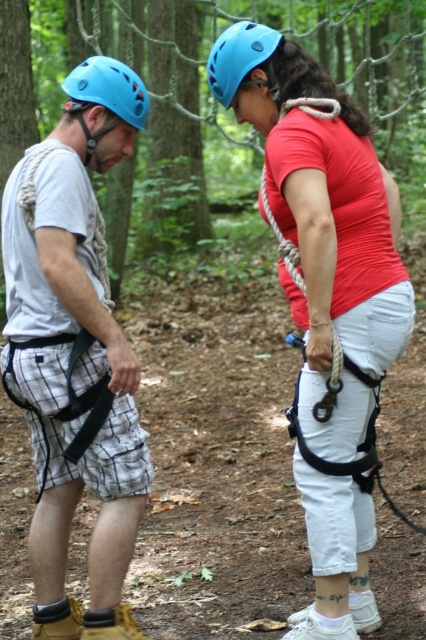
Can you confirm if matte black harness at left is wider than blue matte helmet at upper center?

Indeed, matte black harness at left has a greater width compared to blue matte helmet at upper center.

Between point (42, 182) and point (238, 32), which one is positioned behind?

Positioned behind is point (238, 32).

Who is more distant from viewer, (31, 184) or (224, 68)?

The point (224, 68) is behind.

At what (x,y) coordinates should I click in order to perform the action: click on matte black harness at left. Please return your answer as a coordinate pair (x, y). The image size is (426, 640). Looking at the image, I should click on (74, 352).

Is blue matte helmet at left above blue matte helmet at upper center?

No.

Can you confirm if blue matte helmet at left is shorter than blue matte helmet at upper center?

Yes, blue matte helmet at left is shorter than blue matte helmet at upper center.

Is point (114, 83) farther from viewer compared to point (265, 29)?

No.

Locate an element on the screen. Image resolution: width=426 pixels, height=640 pixels. blue matte helmet at left is located at coordinates (109, 88).

Does matte black harness at left appear on the left side of blue matte helmet at left?

Indeed, matte black harness at left is positioned on the left side of blue matte helmet at left.

Which is in front, point (25, 241) or point (71, 77)?

Positioned in front is point (25, 241).

Does point (114, 600) lie behind point (88, 88)?

No, it is in front of (88, 88).

Identify the location of matte black harness at left. Image resolution: width=426 pixels, height=640 pixels. [74, 352].